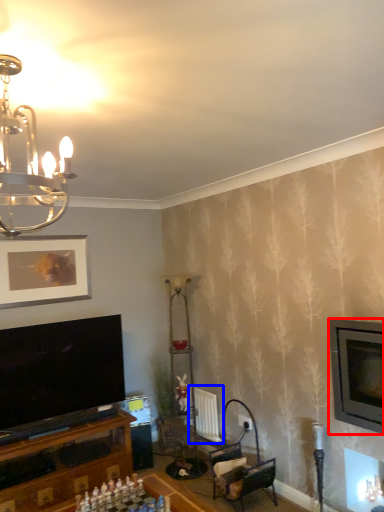
Question: Which point is closer to the camera, television (highlighted by a red box) or radiator (highlighted by a blue box)?

Choices:
 (A) television
 (B) radiator

Answer: (A)